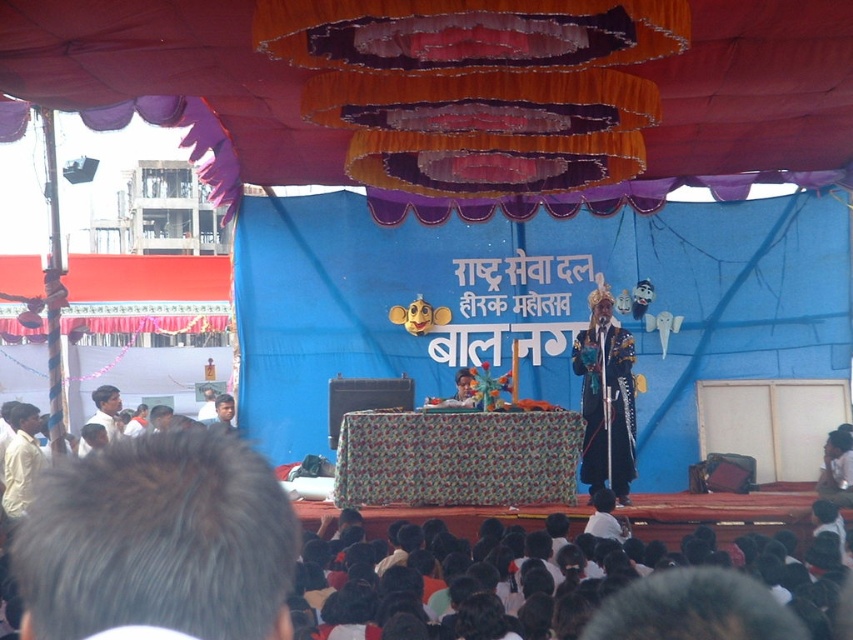
Question: Which point is closer to the camera?

Choices:
 (A) (595, 394)
 (B) (585, 552)

Answer: (B)

Question: Which of the following is the farthest from the observer?

Choices:
 (A) (740, 156)
 (B) (544, 624)
 (C) (627, 355)

Answer: (A)

Question: Which is nearer to the shiny blue costume at center?

Choices:
 (A) black fabric at lower center
 (B) textured fabric canopy at upper center

Answer: (B)

Question: Does textured fabric canopy at upper center have a lesser width compared to shiny blue costume at center?

Choices:
 (A) yes
 (B) no

Answer: (B)

Question: Considering the relative positions of textured fabric canopy at upper center and black fabric at lower center in the image provided, where is textured fabric canopy at upper center located with respect to black fabric at lower center?

Choices:
 (A) below
 (B) above

Answer: (B)

Question: Is textured fabric canopy at upper center bigger than shiny blue costume at center?

Choices:
 (A) no
 (B) yes

Answer: (B)